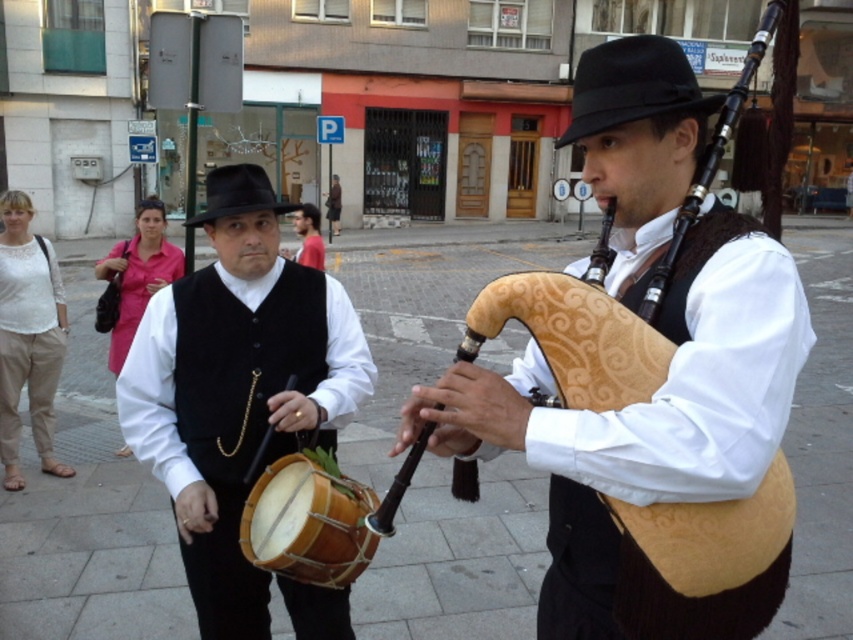
Describe the element at coordinates (236, 387) in the screenshot. I see `matte black vest at center` at that location.

Find the location of `matte black vest at center`. matte black vest at center is located at coordinates tap(236, 387).

What are the coordinates of `matte black vest at center` in the screenshot? It's located at (236, 387).

Is matte black vest at center thinner than natural wood drum at center?

In fact, matte black vest at center might be wider than natural wood drum at center.

Between matte black vest at center and natural wood drum at center, which one has more height?

Standing taller between the two is matte black vest at center.

Measure the distance between point (x=223, y=314) and camera.

2.47 meters

Where is `matte black vest at center`? matte black vest at center is located at coordinates pos(236,387).

Measure the distance between point (224, 275) and camera.

A distance of 2.52 meters exists between point (224, 275) and camera.

Which is below, matte black vest at center or black felt fedora at center?

matte black vest at center is below.

In order to click on matte black vest at center in this screenshot , I will do `click(236, 387)`.